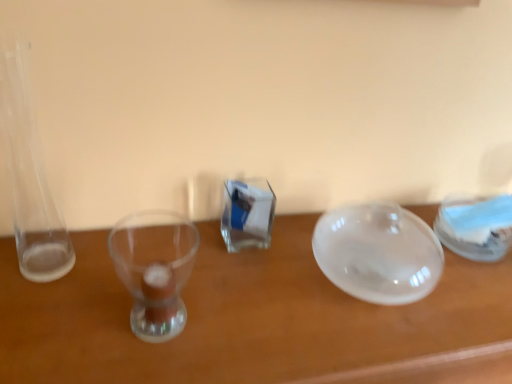
Identify the location of free space underneath transparent plastic container at right (from a real-world perspective). This screenshot has width=512, height=384. (470, 247).